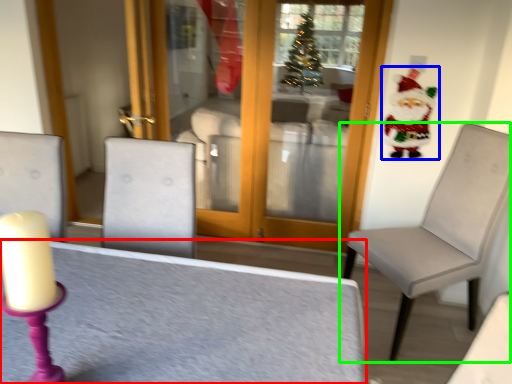
Question: Which object is the closest to the table (highlighted by a red box)? Choose among these: santa claus (highlighted by a blue box) or chair (highlighted by a green box).

Choices:
 (A) santa claus
 (B) chair

Answer: (B)